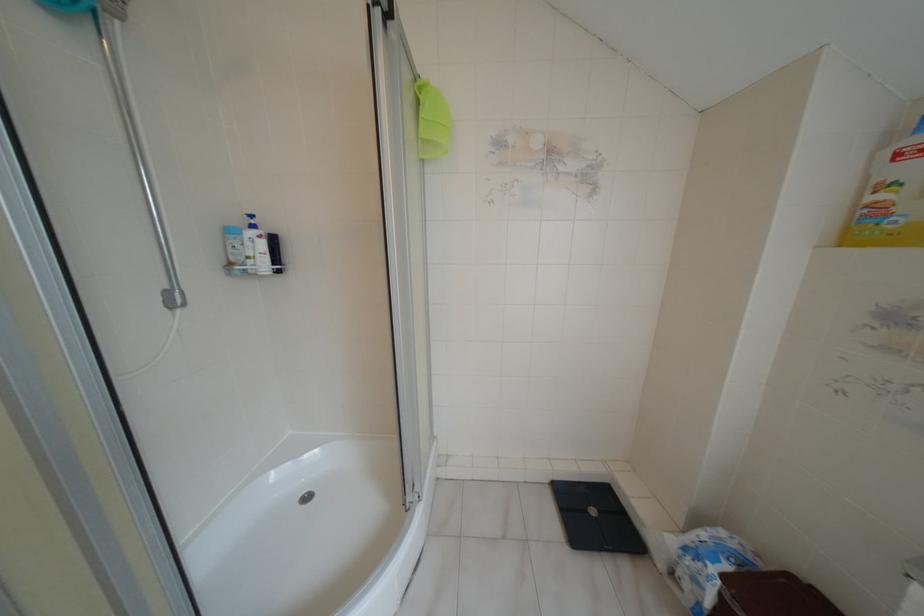
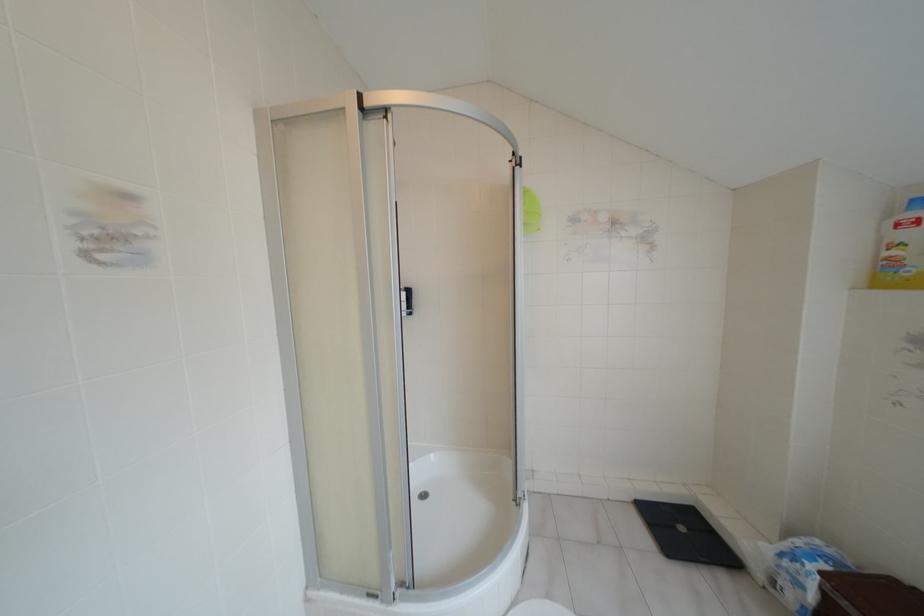
Locate, in the second image, the point that corresponds to (712,569) in the first image.

(809, 565)